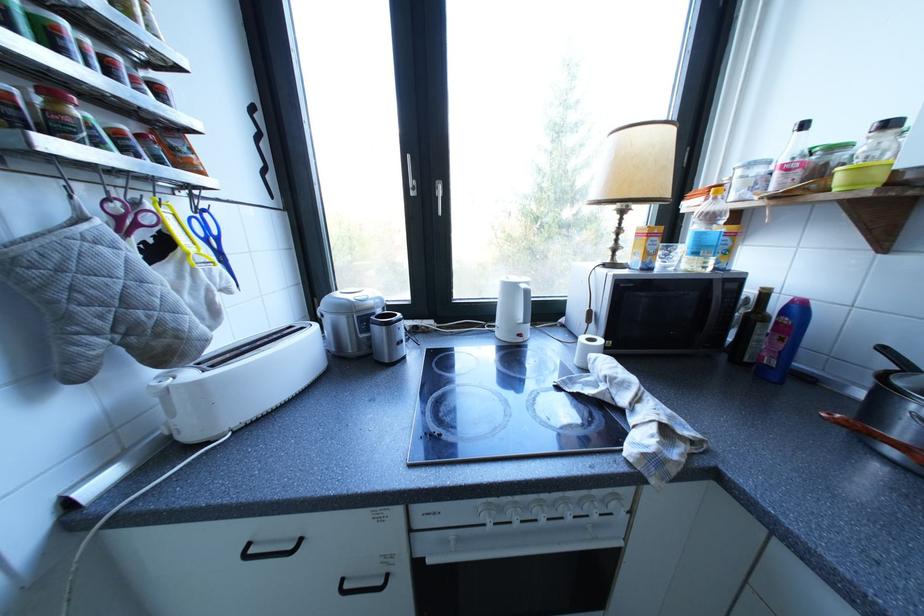
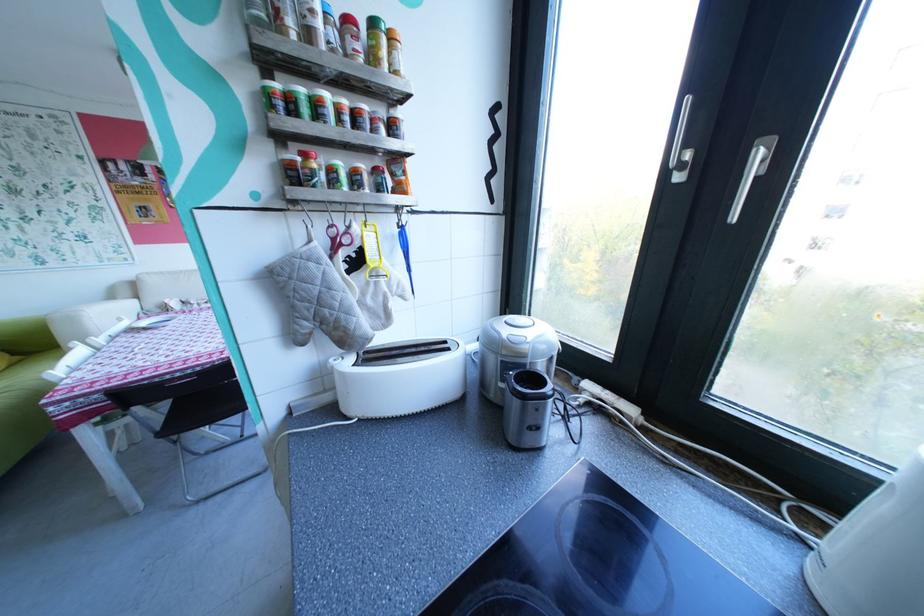
Question: How did the camera likely rotate?

Choices:
 (A) Left
 (B) Right
 (C) Up
 (D) Down

Answer: (A)